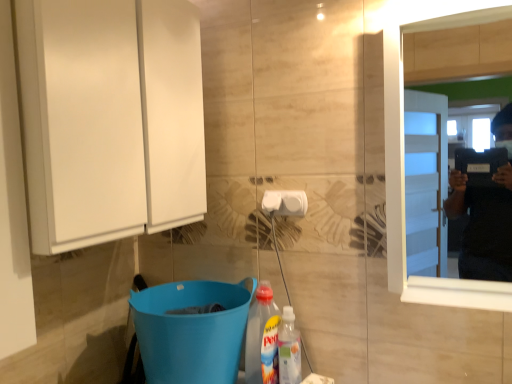
Question: Considering the positions of point (84, 206) and point (407, 0), is point (84, 206) closer or farther from the camera than point (407, 0)?

Choices:
 (A) farther
 (B) closer

Answer: (B)

Question: From the image's perspective, is white glossy cabinet at left above or below white wooden mirror at right?

Choices:
 (A) below
 (B) above

Answer: (B)

Question: Estimate the real-world distances between objects in this image. Which object is closer to the white plastic towel bar at center?

Choices:
 (A) white wooden mirror at right
 (B) white glossy cabinet at left
 (C) translucent plastic bottle at lower center
 (D) translucent plastic bottle at lower center

Answer: (D)

Question: Which of these objects is positioned farthest from the white glossy cabinet at left?

Choices:
 (A) translucent plastic bottle at lower center
 (B) white plastic towel bar at center
 (C) white wooden mirror at right
 (D) translucent plastic bottle at lower center

Answer: (D)